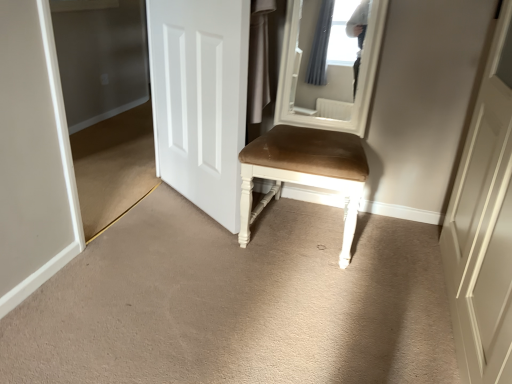
At what (x,y) coordinates should I click in order to perform the action: click on vacant space to the left of suede-like brown chair at center. Please return your answer as a coordinate pair (x, y). Looking at the image, I should click on (188, 242).